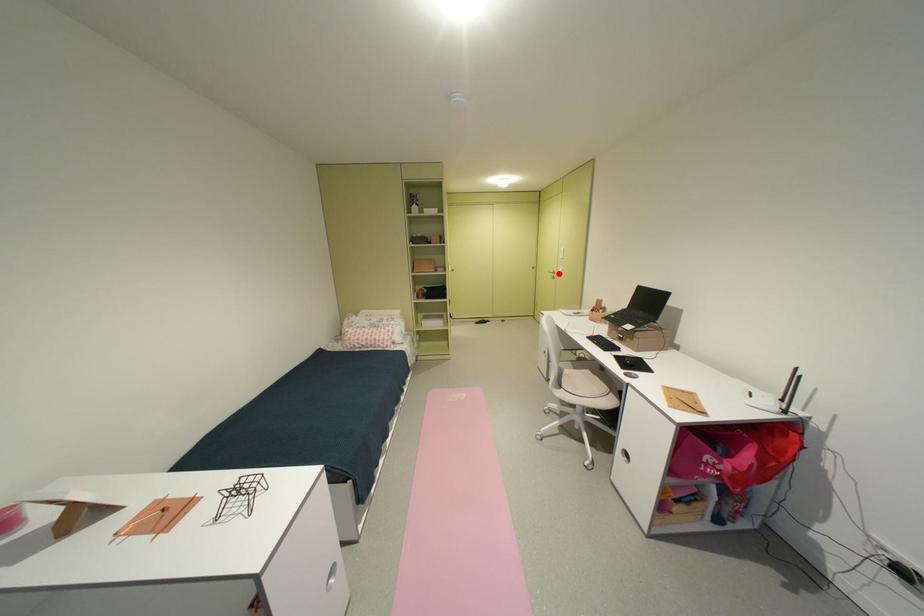
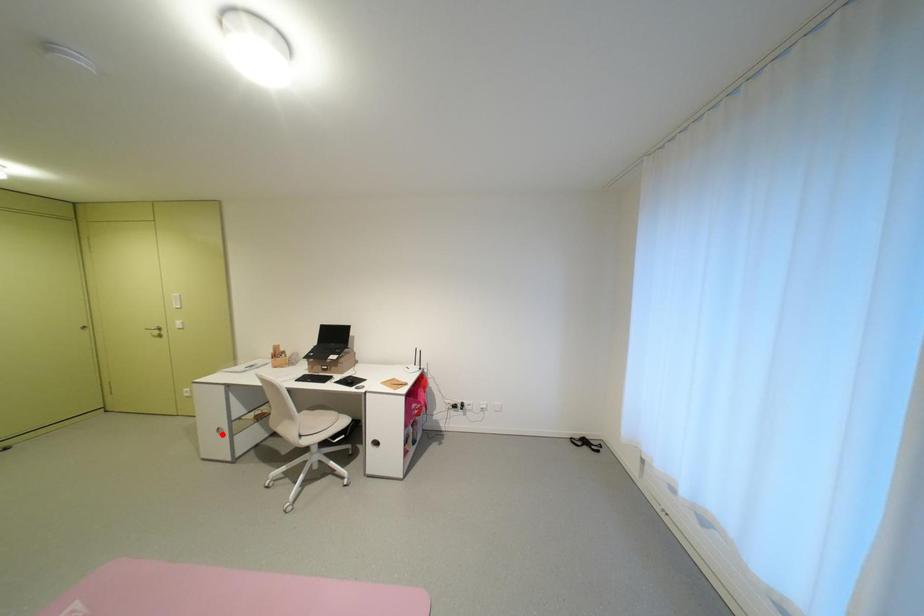
I am providing you with two images of the same scene from different viewpoints. A red point is marked on the first image and another point is marked on the second image. Does the point marked in image1 correspond to the same location as the one in image2?

No